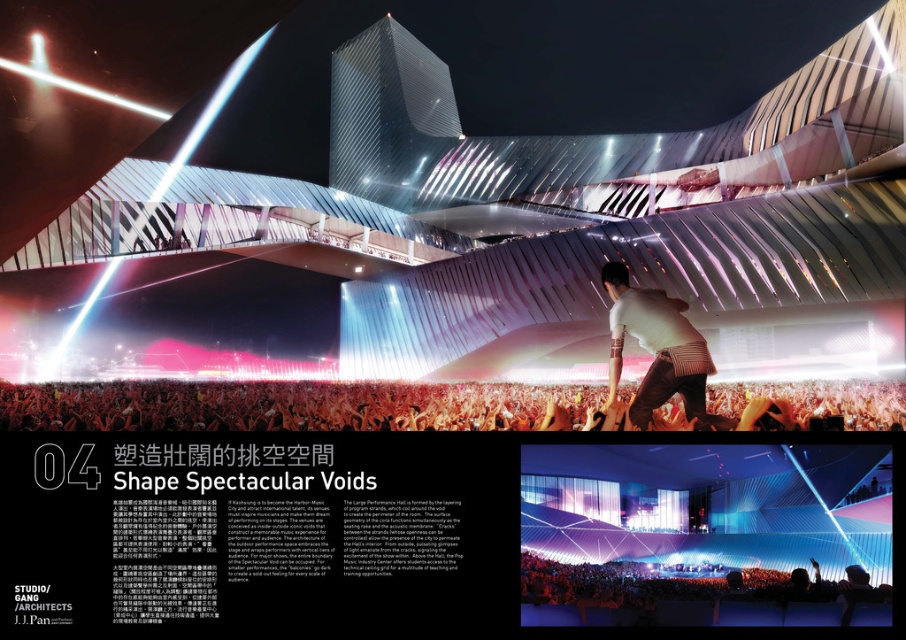
Question: Is translucent blue fabric at center positioned before white cotton shirt at center?

Choices:
 (A) no
 (B) yes

Answer: (B)

Question: Based on their relative distances, which object is nearer to the white cotton shirt at center?

Choices:
 (A) white matte shirt at upper center
 (B) translucent blue fabric at center

Answer: (B)

Question: Considering the real-world distances, which object is closest to the translucent blue fabric at center?

Choices:
 (A) white cotton shirt at center
 (B) white matte shirt at upper center

Answer: (B)

Question: In this image, where is translucent blue fabric at center located relative to white matte shirt at upper center?

Choices:
 (A) above
 (B) below

Answer: (B)

Question: Which point is closer to the camera?

Choices:
 (A) (900, 387)
 (B) (615, 273)
 (C) (707, 536)

Answer: (B)

Question: Does white cotton shirt at center have a smaller size compared to white matte shirt at upper center?

Choices:
 (A) yes
 (B) no

Answer: (B)